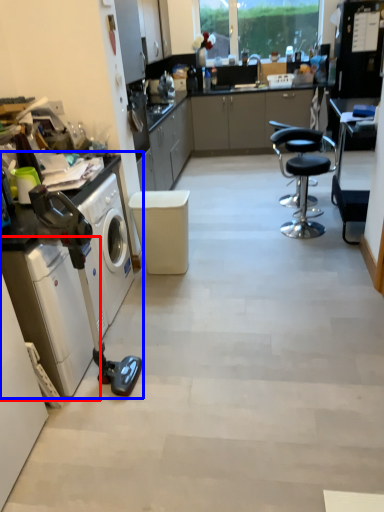
Question: Among these objects, which one is nearest to the camera, washing machine (highlighted by a red box) or home appliance (highlighted by a blue box)?

Choices:
 (A) washing machine
 (B) home appliance

Answer: (B)